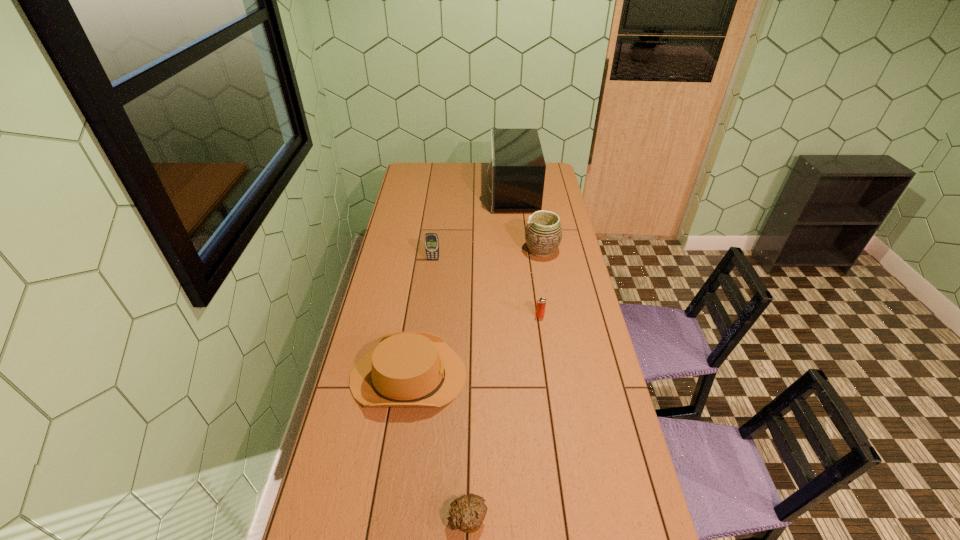
Find the location of a particular element. This screenshot has width=960, height=540. microwave oven that is at the right edge is located at coordinates (517, 167).

Where is `pottery present at the right edge`? The width and height of the screenshot is (960, 540). pottery present at the right edge is located at coordinates (543, 234).

Image resolution: width=960 pixels, height=540 pixels. What are the coordinates of `object that is at the far right corner` in the screenshot? It's located at (517, 167).

Locate an element on the screen. The height and width of the screenshot is (540, 960). vacant region at the left edge of the desktop is located at coordinates 390,248.

At what (x,y) coordinates should I click in order to perform the action: click on vacant region at the right edge of the desktop. Please return your answer as a coordinate pair (x, y). Looking at the image, I should click on (580, 401).

Image resolution: width=960 pixels, height=540 pixels. I want to click on free space at the far right corner of the desktop, so click(x=552, y=169).

The width and height of the screenshot is (960, 540). I want to click on free area in between the microwave oven and the pottery, so click(x=527, y=221).

Where is `free space that is in between the cellular telephone and the second nearest object`? This screenshot has width=960, height=540. free space that is in between the cellular telephone and the second nearest object is located at coordinates (420, 318).

Locate an element on the screen. vacant area that lies between the muffin and the second tallest object is located at coordinates (505, 384).

Where is `free spot between the second nearest object and the third tallest object`? free spot between the second nearest object and the third tallest object is located at coordinates (420, 318).